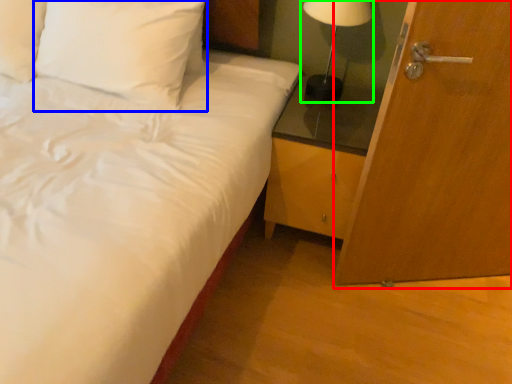
Question: Considering the real-world distances, which object is closest to door (highlighted by a red box)? pillow (highlighted by a blue box) or table lamp (highlighted by a green box).

Choices:
 (A) pillow
 (B) table lamp

Answer: (B)